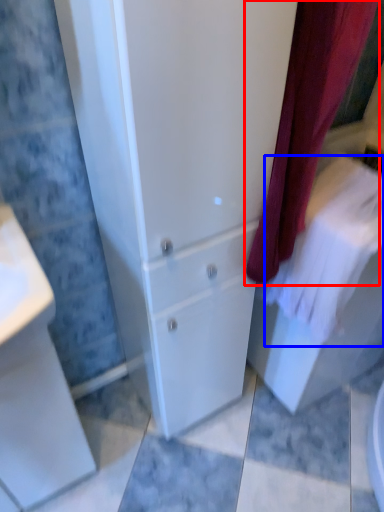
Question: Which object appears closest to the camera in this image, curtain (highlighted by a red box) or bath towel (highlighted by a blue box)?

Choices:
 (A) curtain
 (B) bath towel

Answer: (A)